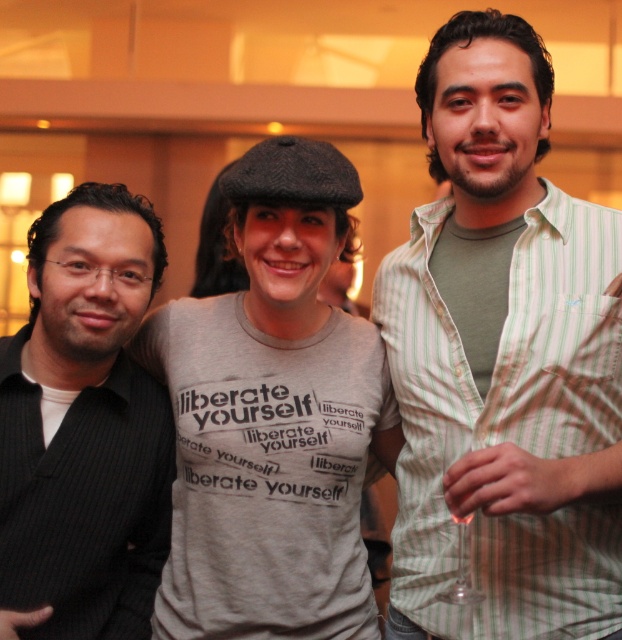
You are standing in the room and want to find the green striped shirt at center. According to the coordinates provided, where should you look in the image?

The green striped shirt at center is located at coordinates point (503, 358).

You are standing 5 feet away from the camera. You want to take a photo of the green striped shirt at center. Can you reach it without moving closer than 4 feet?

The green striped shirt at center is 4.32 feet away from the camera. Since you are standing 5 feet away, you are already 0.68 feet farther than the required 4 feet distance. Therefore, you can reach the green striped shirt at center without moving closer than 4 feet.